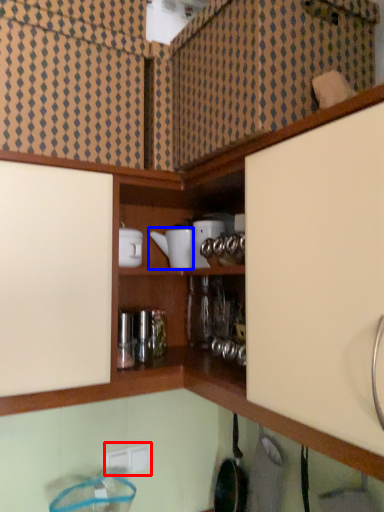
Question: Which point is closer to the camera, electric outlet (highlighted by a red box) or appliance (highlighted by a blue box)?

Choices:
 (A) electric outlet
 (B) appliance

Answer: (B)